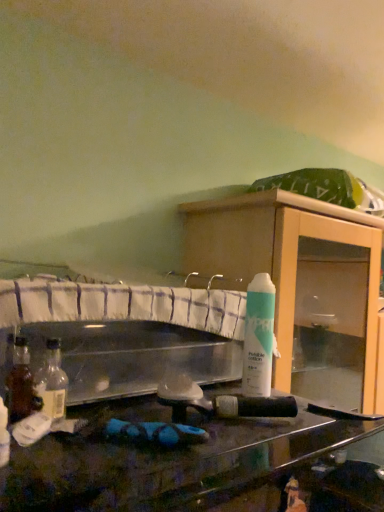
Question: Does wooden cabinet at center have a greater width compared to white matte spray can at upper right?

Choices:
 (A) yes
 (B) no

Answer: (A)

Question: From a real-world perspective, is wooden cabinet at center physically above white matte spray can at upper right?

Choices:
 (A) yes
 (B) no

Answer: (B)

Question: From the image's perspective, is wooden cabinet at center under white matte spray can at upper right?

Choices:
 (A) no
 (B) yes

Answer: (B)

Question: From a real-world perspective, does wooden cabinet at center sit lower than white matte spray can at upper right?

Choices:
 (A) yes
 (B) no

Answer: (A)

Question: Would you say wooden cabinet at center contains white matte spray can at upper right?

Choices:
 (A) yes
 (B) no

Answer: (B)

Question: Is wooden cabinet at center beside white matte spray can at upper right?

Choices:
 (A) no
 (B) yes

Answer: (A)

Question: Is wooden cabinet at center positioned far away from translucent glass bottle at left, the 2th bottle viewed from the left?

Choices:
 (A) yes
 (B) no

Answer: (B)

Question: Is wooden cabinet at center directly adjacent to translucent glass bottle at left, the first bottle when ordered from right to left?

Choices:
 (A) yes
 (B) no

Answer: (B)

Question: Does wooden cabinet at center turn towards translucent glass bottle at left, the 2th bottle from the front?

Choices:
 (A) yes
 (B) no

Answer: (B)

Question: Considering the relative positions of wooden cabinet at center and translucent glass bottle at left, placed as the 1th bottle when sorted from back to front, in the image provided, is wooden cabinet at center to the right of translucent glass bottle at left, placed as the 1th bottle when sorted from back to front, from the viewer's perspective?

Choices:
 (A) yes
 (B) no

Answer: (A)

Question: Is translucent glass bottle at left, the 2th bottle from the front, at the back of wooden cabinet at center?

Choices:
 (A) yes
 (B) no

Answer: (B)

Question: From the image's perspective, is wooden cabinet at center located beneath translucent glass bottle at left, placed as the 1th bottle when sorted from back to front?

Choices:
 (A) no
 (B) yes

Answer: (B)

Question: Is translucent plastic bottle at lower left, positioned as the 1th bottle in front-to-back order, at the left side of white matte spray can at upper right?

Choices:
 (A) no
 (B) yes

Answer: (B)